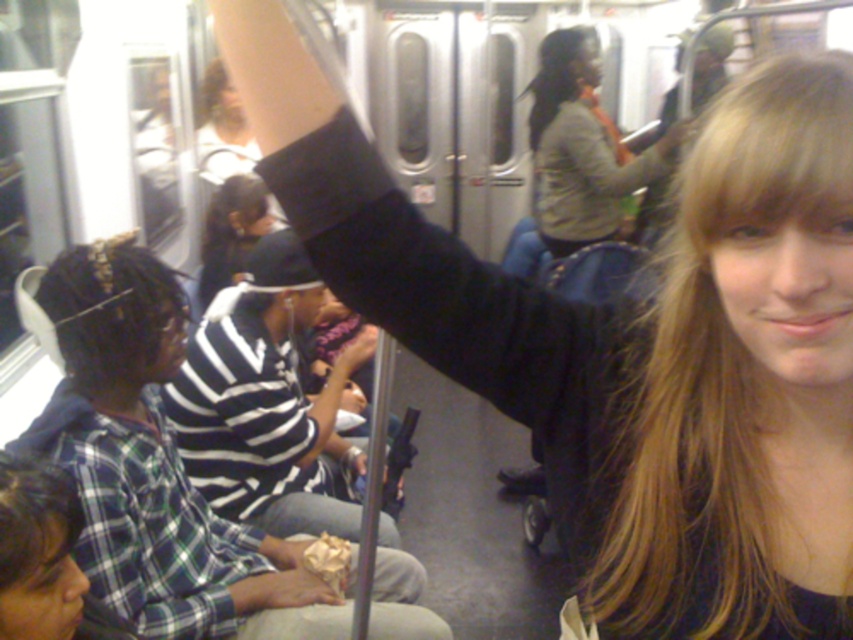
Is point (169, 492) positioned behind point (326, 428)?

No.

From the picture: Is plaid shirt at lower left positioned at the back of black striped shirt at center?

No, plaid shirt at lower left is in front of black striped shirt at center.

Is point (252, 582) positioned after point (241, 520)?

No, it is in front of (241, 520).

At what (x,y) coordinates should I click in order to perform the action: click on plaid shirt at lower left. Please return your answer as a coordinate pair (x, y). Looking at the image, I should click on (151, 461).

Can you confirm if black striped shirt at center is positioned below beige fabric jacket at center?

Indeed, black striped shirt at center is positioned under beige fabric jacket at center.

Is point (286, 458) closer to viewer compared to point (608, 170)?

Yes, it is in front of point (608, 170).

Identify the location of black striped shirt at center. (267, 404).

Is point (177, 349) positioned behind point (573, 244)?

No, (177, 349) is closer to viewer.

Does plaid shirt at lower left appear on the left side of beige fabric jacket at center?

Answer: Yes, plaid shirt at lower left is to the left of beige fabric jacket at center.

Identify the location of plaid shirt at lower left. The height and width of the screenshot is (640, 853). (151, 461).